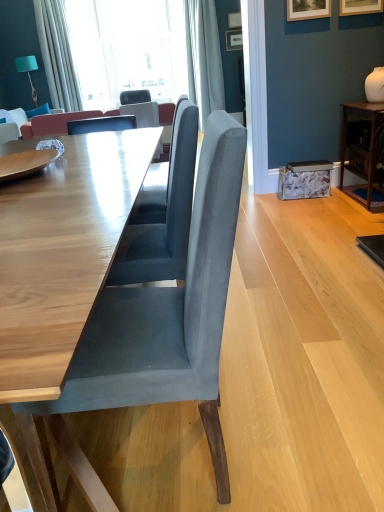
Image resolution: width=384 pixels, height=512 pixels. I want to click on free space between dark wood table at right, marked as the 1th table in a right-to-left arrangement, and suede gray chair at center, which appears as the third chair when viewed from the back, so click(305, 285).